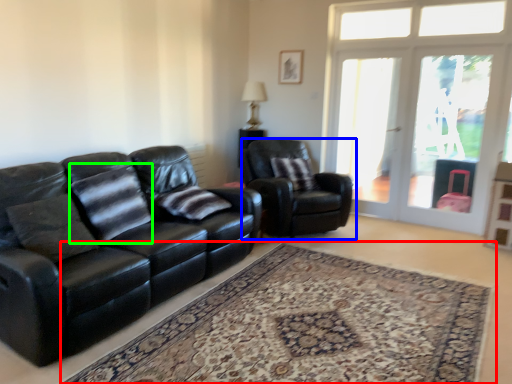
Question: Which object is the closest to the plain (highlighted by a red box)? Choose among these: chair (highlighted by a blue box) or pillow (highlighted by a green box).

Choices:
 (A) chair
 (B) pillow

Answer: (B)